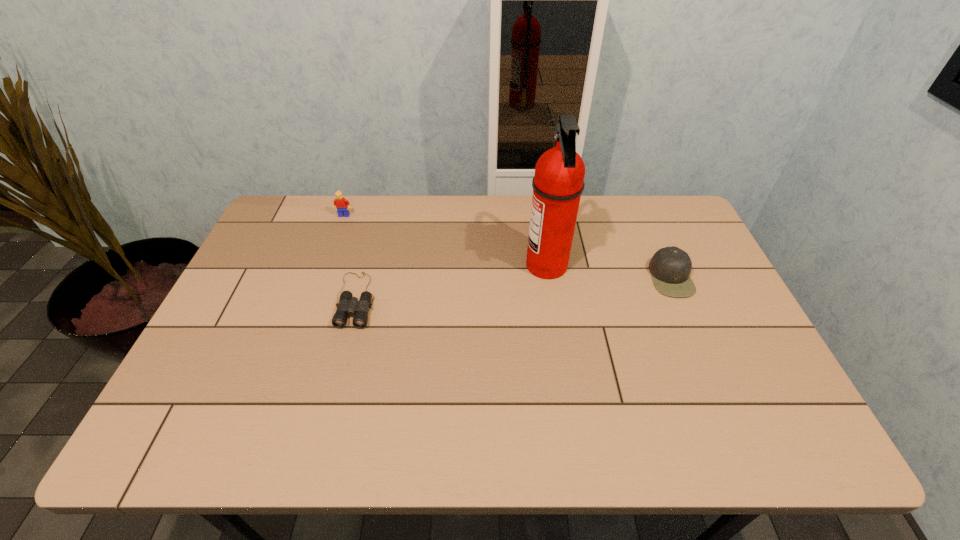
Where is `the tallest object`? the tallest object is located at coordinates (558, 183).

Locate an element on the screen. This screenshot has width=960, height=540. fire extinguisher is located at coordinates (558, 183).

Identify the location of Lego. The width and height of the screenshot is (960, 540). (340, 203).

Locate an element on the screen. The image size is (960, 540). the farthest object is located at coordinates (340, 203).

I want to click on the third tallest object, so click(x=670, y=267).

The width and height of the screenshot is (960, 540). I want to click on the rightmost object, so tap(670, 267).

Find the location of a particular element. This screenshot has width=960, height=540. the shortest object is located at coordinates (348, 305).

At what (x,y) coordinates should I click in order to perform the action: click on binoculars. Please return your answer as a coordinate pair (x, y). Looking at the image, I should click on (348, 305).

Identify the location of vacant region located on the side of the second object from right to left near the handle. This screenshot has height=540, width=960. (505, 266).

At what (x,y) coordinates should I click in order to perform the action: click on vacant point located on the side of the second object from right to left near the handle. Please return your answer as a coordinate pair (x, y). The width and height of the screenshot is (960, 540). Looking at the image, I should click on (413, 266).